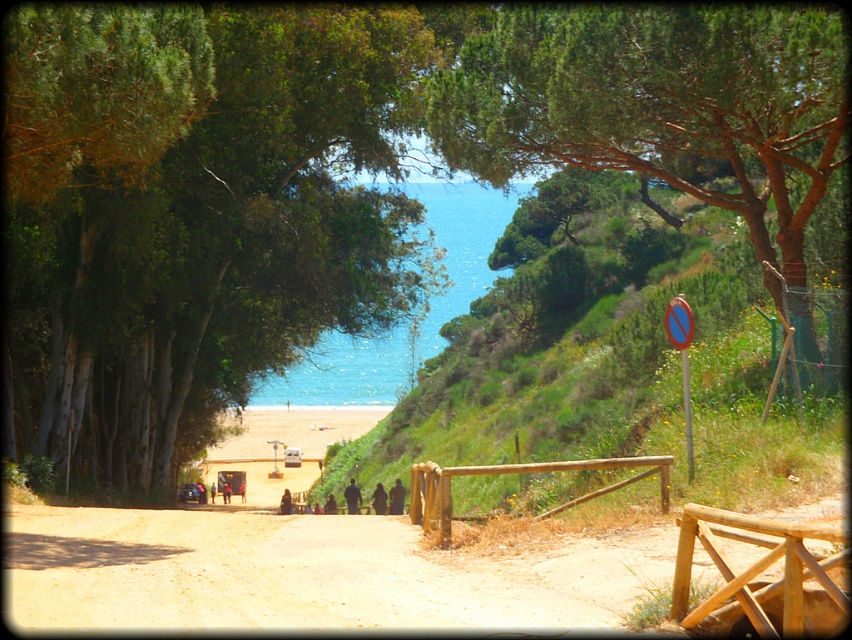
Question: Which of these objects is positioned closest to the blue water at center?

Choices:
 (A) green leafy tree at upper right
 (B) green grassy hillside at center
 (C) green leafy tree at center

Answer: (B)

Question: Is green leafy tree at center above blue water at center?

Choices:
 (A) no
 (B) yes

Answer: (A)

Question: Which object is the closest to the green leafy tree at upper right?

Choices:
 (A) green grassy hillside at center
 (B) blue water at center

Answer: (A)

Question: Estimate the real-world distances between objects in this image. Which object is farther from the green grassy hillside at center?

Choices:
 (A) blue water at center
 (B) green leafy tree at upper right
 (C) green leafy tree at center

Answer: (A)

Question: Does green grassy hillside at center have a smaller size compared to green leafy tree at upper right?

Choices:
 (A) yes
 (B) no

Answer: (B)

Question: Does green leafy tree at center have a greater width compared to green leafy tree at upper right?

Choices:
 (A) no
 (B) yes

Answer: (A)